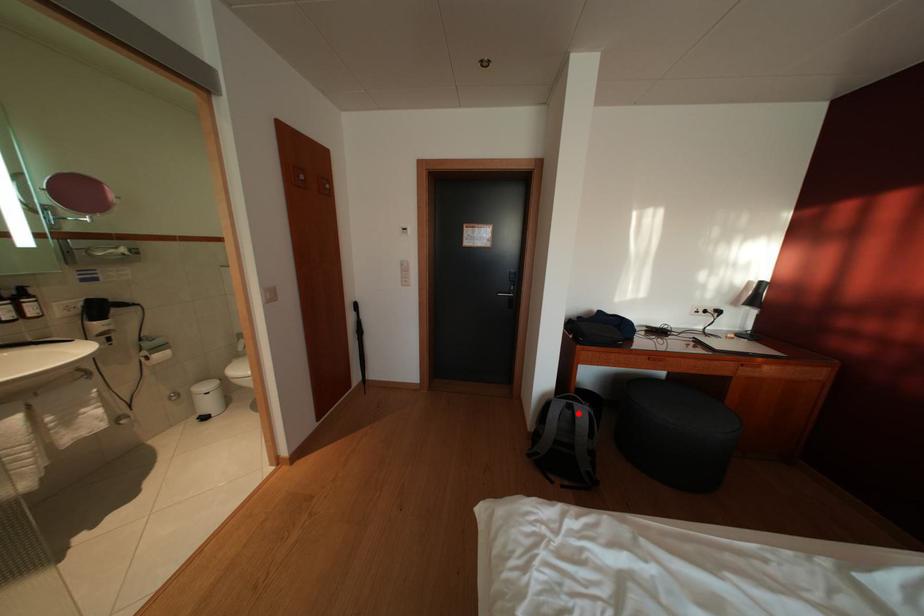
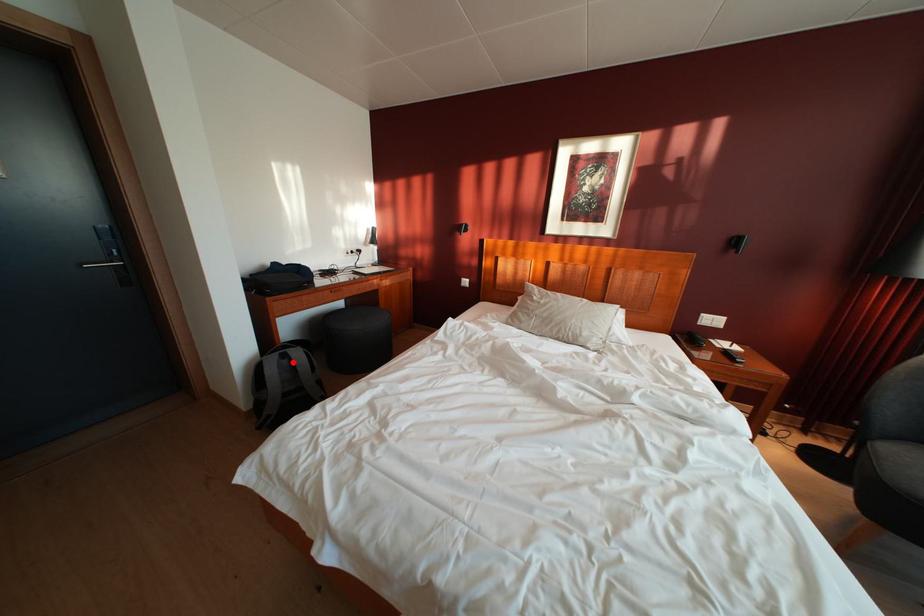
I am providing you with two images of the same scene from different viewpoints. A red point is marked on the first image and another point is marked on the second image. Do the highlighted points in image1 and image2 indicate the same real-world spot?

Yes